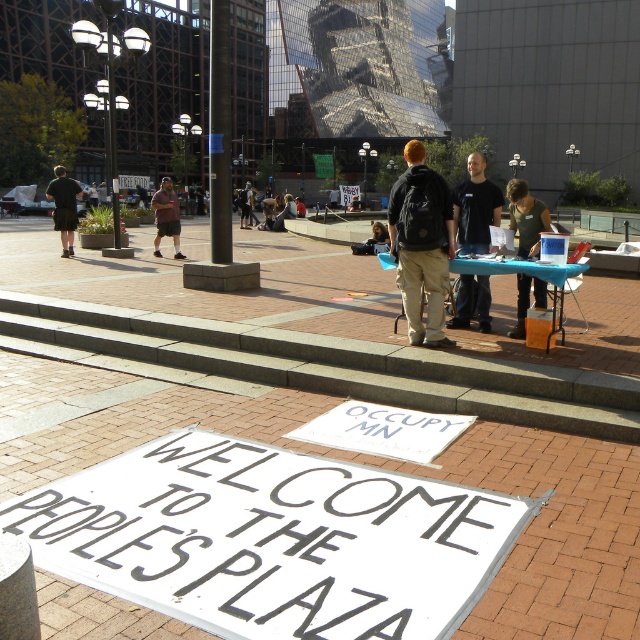
You are a photographer trying to capture a candid shot of the seated person at the table without blocking the dark brown leather jacket at center. Where should you position yourself relative to the dark brown shorts at left?

You should position yourself to the right of the dark brown shorts at left since it is under the dark brown leather jacket at center, so moving right would allow you to avoid blocking the jacket while capturing the seated person.